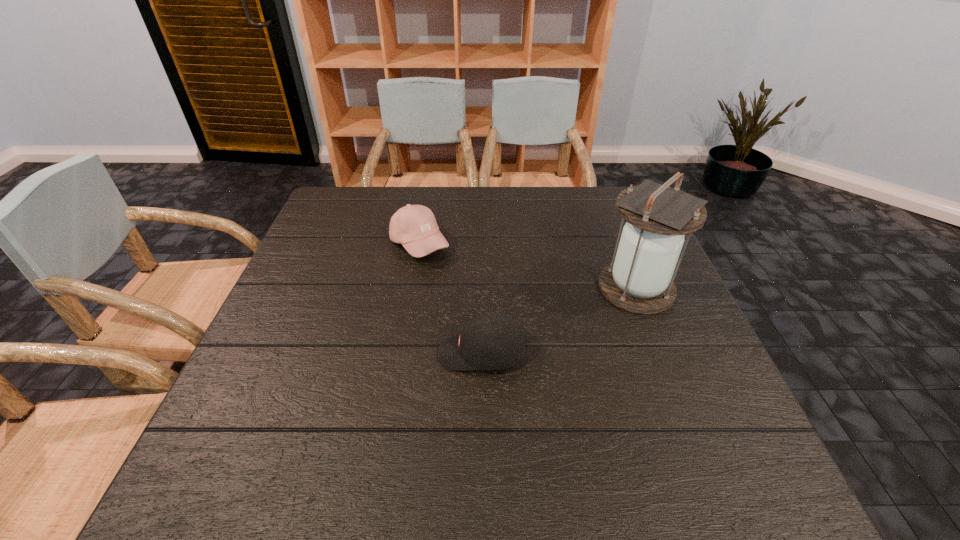
The width and height of the screenshot is (960, 540). In order to click on vacant point that satisfies the following two spatial constraints: 1. on the front-facing side of the rightmost object; 2. on the left side of the farther baseball cap in this screenshot , I will do `click(412, 288)`.